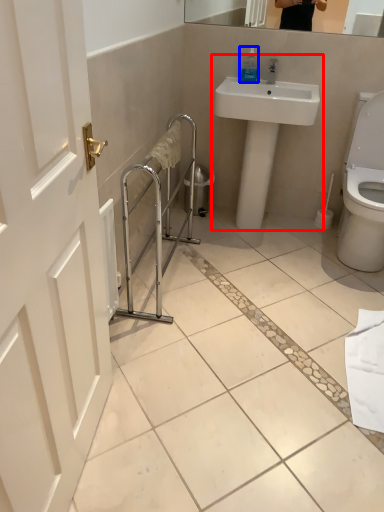
Question: Which object appears closest to the camera in this image, sink (highlighted by a red box) or soap dispenser (highlighted by a blue box)?

Choices:
 (A) sink
 (B) soap dispenser

Answer: (A)